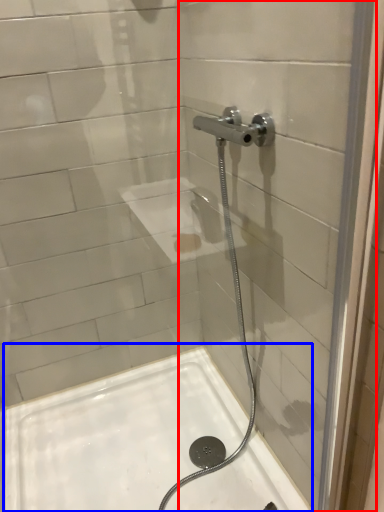
Question: Which object is further to the camera taking this photo, glass door (highlighted by a red box) or bath (highlighted by a blue box)?

Choices:
 (A) glass door
 (B) bath

Answer: (B)